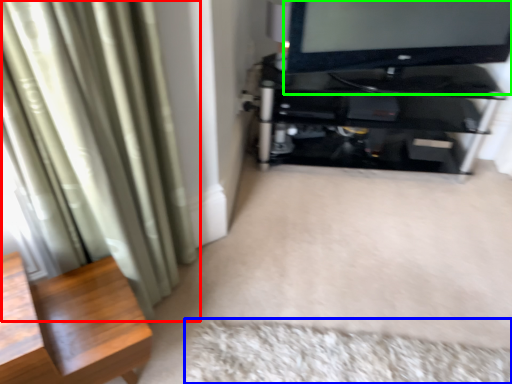
Question: Estimate the real-world distances between objects in this image. Which object is closer to curtain (highlighted by a red box), mat (highlighted by a blue box) or television (highlighted by a green box)?

Choices:
 (A) mat
 (B) television

Answer: (A)